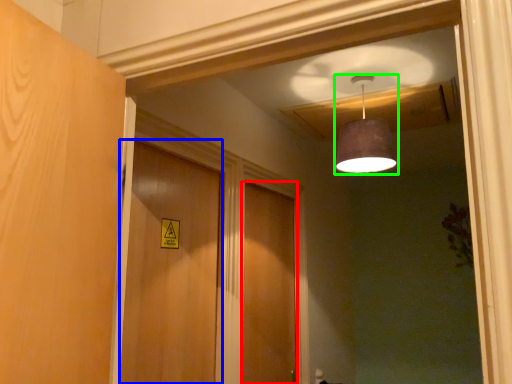
Question: Which is nearer to the door (highlighted by a red box)? door (highlighted by a blue box) or lamp (highlighted by a green box).

Choices:
 (A) door
 (B) lamp

Answer: (A)